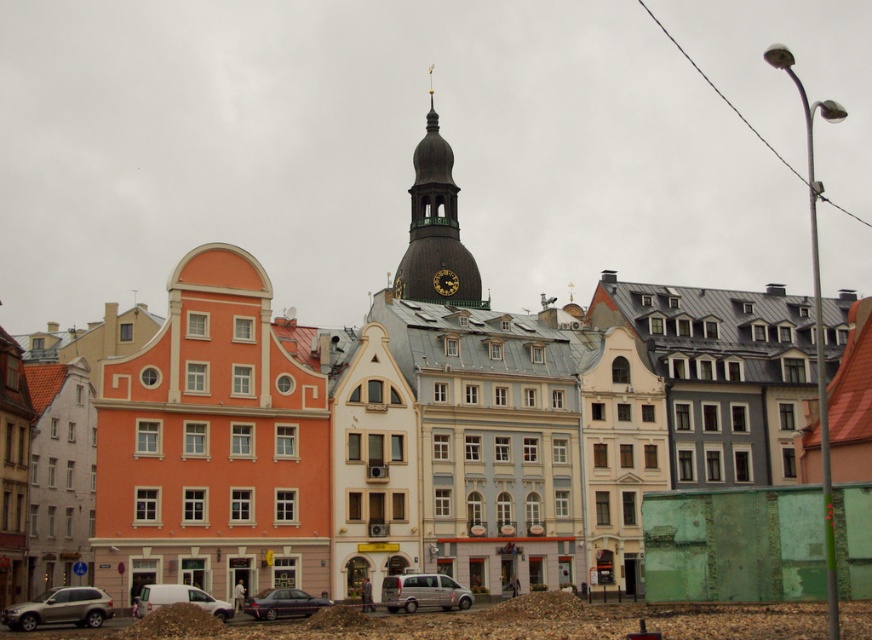
Is point (229, 433) less distant than point (67, 621)?

No.

In the scene shown: Can you confirm if orange matte building at left is shorter than silver metallic suv at lower left?

No.

At what (x,y) coordinates should I click in order to perform the action: click on orange matte building at left. Please return your answer as a coordinate pair (x, y). The height and width of the screenshot is (640, 872). Looking at the image, I should click on (213, 444).

Between point (274, 604) and point (444, 275), which one is positioned in front?

Point (274, 604) is in front.

Is the position of metallic gray sedan at center more distant than that of gold metallic clock at center?

No.

Who is more forward, (293,596) or (450,273)?

Point (293,596)

Locate an element on the screen. metallic gray sedan at center is located at coordinates (283, 604).

Is orange matte building at left thinner than gold metallic clock at center?

In fact, orange matte building at left might be wider than gold metallic clock at center.

Between orange matte building at left and gold metallic clock at center, which one is positioned lower?

orange matte building at left is lower down.

Who is more distant from viewer, (284,429) or (441,273)?

The point (441,273) is behind.

Locate an element on the screen. This screenshot has width=872, height=640. orange matte building at left is located at coordinates (213, 444).